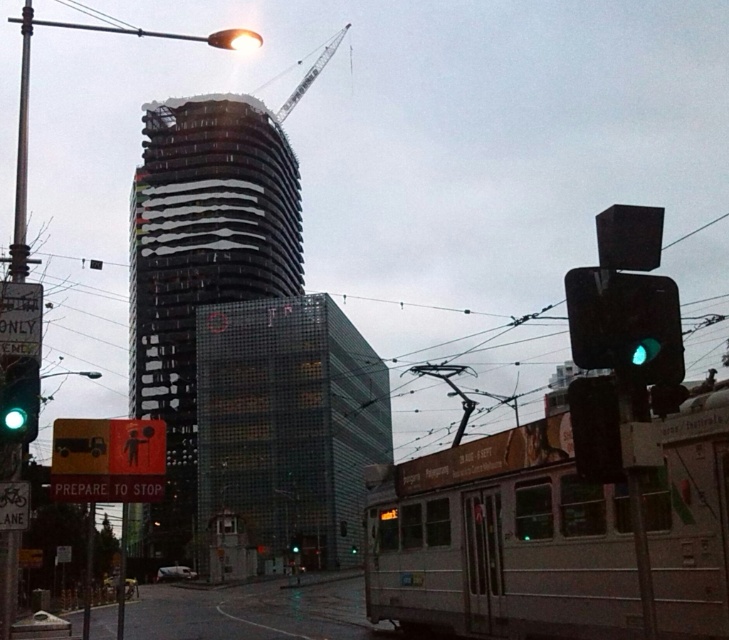
Question: Which is farther from the reflective glass tower at center?

Choices:
 (A) transparent glass building at center
 (B) green glass traffic light at left
 (C) green glass traffic light at center
 (D) metallic gray crane at upper center

Answer: (B)

Question: Considering the real-world distances, which object is farthest from the green glass traffic light at center?

Choices:
 (A) metallic gray crane at upper center
 (B) reflective glass tower at center

Answer: (A)

Question: Does transparent glass building at center have a lesser width compared to metallic gray crane at upper center?

Choices:
 (A) no
 (B) yes

Answer: (A)

Question: Which is nearer to the green glass traffic light at left?

Choices:
 (A) reflective glass tower at center
 (B) transparent glass building at center
 (C) green glass traffic light at center

Answer: (C)

Question: Is reflective glass tower at center further to the viewer compared to transparent glass building at center?

Choices:
 (A) no
 (B) yes

Answer: (A)

Question: Is silver metallic train at center wider than green glass traffic light at center?

Choices:
 (A) yes
 (B) no

Answer: (A)